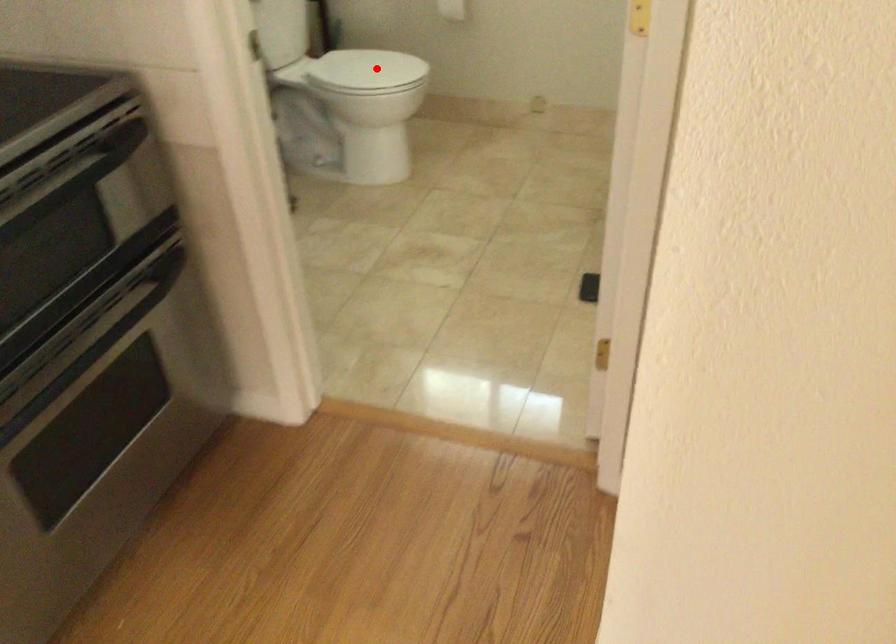
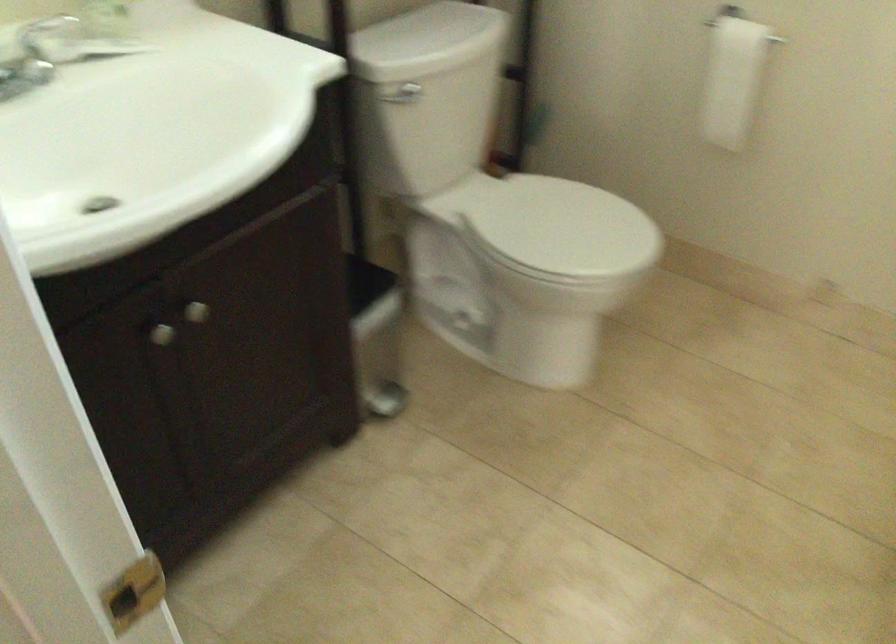
The point at the highlighted location is marked in the first image. Where is the corresponding point in the second image?

(564, 225)